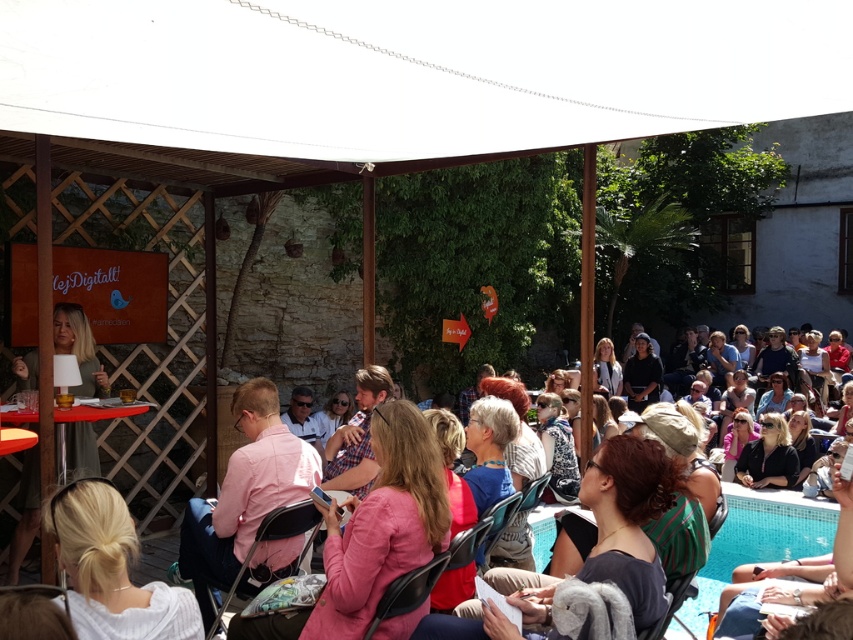
Can you confirm if white fabric canopy at upper center is thinner than pink fabric jacket at center?

No.

Who is lower down, white fabric canopy at upper center or pink fabric jacket at center?

pink fabric jacket at center is below.

Is point (280, 134) closer to camera compared to point (616, 548)?

That is False.

At what (x,y) coordinates should I click in order to perform the action: click on white fabric canopy at upper center. Please return your answer as a coordinate pair (x, y). This screenshot has height=640, width=853. Looking at the image, I should click on (392, 81).

Which is above, white fabric canopy at upper center or matte pink shirt at center?

white fabric canopy at upper center is above.

From the picture: Can you confirm if white fabric canopy at upper center is bigger than matte pink shirt at center?

Correct, white fabric canopy at upper center is larger in size than matte pink shirt at center.

Who is more forward, (x=618, y=77) or (x=712, y=580)?

Point (x=618, y=77) is in front.

Identify the location of white fabric canopy at upper center. The width and height of the screenshot is (853, 640). (392, 81).

Is pink fabric jacket at center thinner than matte pink shirt at center?

Yes, pink fabric jacket at center is thinner than matte pink shirt at center.

Between pink fabric jacket at center and matte pink shirt at center, which one is positioned higher?

pink fabric jacket at center

Which is behind, point (445, 618) or point (538, 560)?

Positioned behind is point (538, 560).

Locate an element on the screen. pink fabric jacket at center is located at coordinates (628, 518).